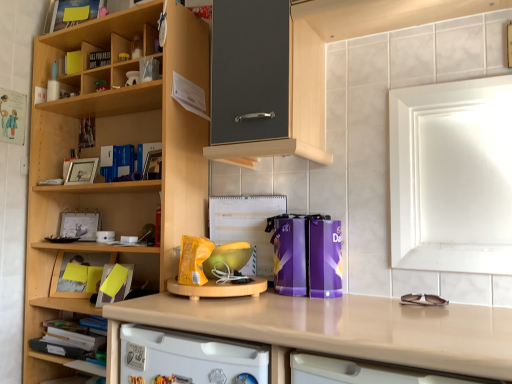
Question: From the image's perspective, is matte black book at upper left, which ranks as the second book in top-to-bottom order, positioned above or below beige laminate countertop at center?

Choices:
 (A) above
 (B) below

Answer: (A)

Question: From a real-world perspective, is matte black book at upper left, which ranks as the second book in top-to-bottom order, positioned above or below beige laminate countertop at center?

Choices:
 (A) below
 (B) above

Answer: (B)

Question: Which of these objects is positioned closest to the wooden shelf at lower left?

Choices:
 (A) wooden cupboard at left
 (B) yellow paper at lower left, arranged as the 1th book when ordered from the bottom
 (C) white glossy dishwasher at lower center
 (D) matte black book at upper left, which is the 3th book in bottom-to-top order
 (E) beige laminate countertop at center

Answer: (B)

Question: Estimate the real-world distances between objects in this image. Which object is farther from the yellow matte bookshelf at upper left, placed as the 2th book when sorted from back to front?

Choices:
 (A) white glossy medicine cabinet at upper right
 (B) white glossy dishwasher at lower center
 (C) yellow paper at lower left, arranged as the 1th book when ordered from the bottom
 (D) beige laminate countertop at center
 (E) matte black book at upper left, which ranks as the second book in top-to-bottom order

Answer: (A)